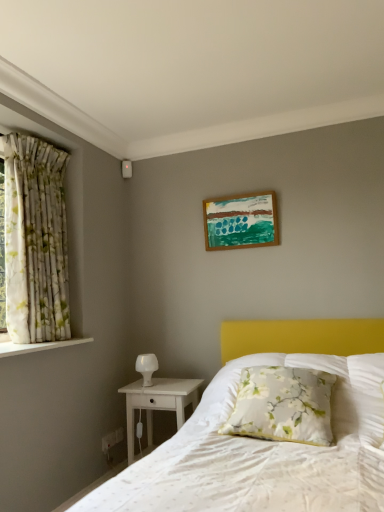
What is the approximate width of floral fabric pillow at center?

It is 49.17 centimeters.

This screenshot has width=384, height=512. What do you see at coordinates (35, 241) in the screenshot?
I see `floral fabric curtain at left` at bounding box center [35, 241].

What do you see at coordinates (241, 221) in the screenshot? The height and width of the screenshot is (512, 384). I see `wooden picture frame at upper center` at bounding box center [241, 221].

Locate an element on the screen. This screenshot has height=512, width=384. white wood nightstand at lower left is located at coordinates (158, 403).

Can you confirm if white wood nightstand at lower left is thinner than wooden picture frame at upper center?

In fact, white wood nightstand at lower left might be wider than wooden picture frame at upper center.

Consider the image. Which is nearer, (172, 404) or (250, 238)?

Point (172, 404) is positioned closer to the camera compared to point (250, 238).

Based on their positions, is white wood nightstand at lower left located to the left or right of wooden picture frame at upper center?

white wood nightstand at lower left is to the left of wooden picture frame at upper center.

Is wooden picture frame at upper center positioned beyond the bounds of floral fabric curtain at left?

Yes, wooden picture frame at upper center is located beyond the bounds of floral fabric curtain at left.

In terms of size, does wooden picture frame at upper center appear bigger or smaller than floral fabric curtain at left?

wooden picture frame at upper center is smaller than floral fabric curtain at left.

Is point (264, 210) farther from viewer compared to point (19, 319)?

Yes, it is.

From the image's perspective, which one is positioned higher, wooden picture frame at upper center or floral fabric curtain at left?

wooden picture frame at upper center, from the image's perspective.

From a real-world perspective, between wooden picture frame at upper center and white wood nightstand at lower left, who is vertically higher?

In real-world perspective, wooden picture frame at upper center is above.

Considering the relative sizes of wooden picture frame at upper center and white wood nightstand at lower left in the image provided, is wooden picture frame at upper center wider than white wood nightstand at lower left?

No, wooden picture frame at upper center is not wider than white wood nightstand at lower left.

At what (x,y) coordinates should I click in order to perform the action: click on nightstand in front of the wooden picture frame at upper center. Please return your answer as a coordinate pair (x, y). The height and width of the screenshot is (512, 384). Looking at the image, I should click on (158, 403).

How many degrees apart are the facing directions of wooden picture frame at upper center and white wood nightstand at lower left?

0.88 degrees.

Are floral fabric curtain at left and wooden picture frame at upper center beside each other?

A: No.

Measure the distance from floral fabric curtain at left to wooden picture frame at upper center.

floral fabric curtain at left is 3.81 feet from wooden picture frame at upper center.

Between floral fabric curtain at left and wooden picture frame at upper center, which one appears on the right side from the viewer's perspective?

From the viewer's perspective, wooden picture frame at upper center appears more on the right side.

Is wooden picture frame at upper center located within floral fabric curtain at left?

No, wooden picture frame at upper center is not inside floral fabric curtain at left.

Is white wood nightstand at lower left bigger or smaller than floral fabric curtain at left?

Clearly, white wood nightstand at lower left is smaller in size than floral fabric curtain at left.

Considering the relative sizes of white wood nightstand at lower left and floral fabric curtain at left in the image provided, is white wood nightstand at lower left thinner than floral fabric curtain at left?

In fact, white wood nightstand at lower left might be wider than floral fabric curtain at left.

Can floral fabric curtain at left be found inside white wood nightstand at lower left?

No, white wood nightstand at lower left does not contain floral fabric curtain at left.

What's the angular difference between white wood nightstand at lower left and floral fabric curtain at left's facing directions?

The angle between the facing direction of white wood nightstand at lower left and the facing direction of floral fabric curtain at left is 87.9 degrees.

Visually, is wooden picture frame at upper center positioned to the left or to the right of white frosted glass table lamp at lower left?

wooden picture frame at upper center is to the right of white frosted glass table lamp at lower left.

Can you confirm if wooden picture frame at upper center is wider than white frosted glass table lamp at lower left?

In fact, wooden picture frame at upper center might be narrower than white frosted glass table lamp at lower left.

From a real-world perspective, is wooden picture frame at upper center beneath white frosted glass table lamp at lower left?

No, from a real-world perspective, wooden picture frame at upper center is not below white frosted glass table lamp at lower left.

Would you say wooden picture frame at upper center contains white frosted glass table lamp at lower left?

No.

Is floral fabric pillow at center touching white frosted glass table lamp at lower left?

No, floral fabric pillow at center is not making contact with white frosted glass table lamp at lower left.

Does floral fabric pillow at center appear on the left side of white frosted glass table lamp at lower left?

No, floral fabric pillow at center is not to the left of white frosted glass table lamp at lower left.

Can you confirm if floral fabric pillow at center is shorter than white frosted glass table lamp at lower left?

In fact, floral fabric pillow at center may be taller than white frosted glass table lamp at lower left.

Is point (255, 426) closer to viewer compared to point (147, 370)?

Yes, point (255, 426) is in front of point (147, 370).

Find the location of a particular element. The height and width of the screenshot is (512, 384). picture frame above the white wood nightstand at lower left (from a real-world perspective) is located at coordinates (241, 221).

The height and width of the screenshot is (512, 384). What are the coordinates of `curtain lying below the wooden picture frame at upper center (from the image's perspective)` in the screenshot? It's located at (35, 241).

Considering their positions, is floral fabric curtain at left positioned closer to white wood nightstand at lower left than wooden picture frame at upper center?

The object closer to white wood nightstand at lower left is floral fabric curtain at left.

Based on their spatial positions, is white frosted glass table lamp at lower left or floral fabric pillow at center closer to floral fabric curtain at left?

white frosted glass table lamp at lower left.

Which object lies further to the anchor point white frosted glass table lamp at lower left, floral fabric pillow at center or floral fabric curtain at left?

floral fabric pillow at center lies further to white frosted glass table lamp at lower left than the other object.

When comparing their distances from wooden picture frame at upper center, does floral fabric pillow at center or white frosted glass table lamp at lower left seem closer?

Based on the image, white frosted glass table lamp at lower left appears to be nearer to wooden picture frame at upper center.

When comparing their distances from floral fabric curtain at left, does white wood nightstand at lower left or floral fabric pillow at center seem closer?

white wood nightstand at lower left lies closer to floral fabric curtain at left than the other object.

Based on the photo, estimate the real-world distances between objects in this image. Which object is further from white frosted glass table lamp at lower left, wooden picture frame at upper center or white wood nightstand at lower left?

wooden picture frame at upper center is further to white frosted glass table lamp at lower left.

Estimate the real-world distances between objects in this image. Which object is closer to white wood nightstand at lower left, floral fabric pillow at center or wooden picture frame at upper center?

Based on the image, floral fabric pillow at center appears to be nearer to white wood nightstand at lower left.

Based on their spatial positions, is white wood nightstand at lower left or floral fabric pillow at center closer to wooden picture frame at upper center?

white wood nightstand at lower left.

In order to click on picture frame located between floral fabric curtain at left and floral fabric pillow at center in the left-right direction in this screenshot , I will do `click(241, 221)`.

Identify the location of curtain between wooden picture frame at upper center and white wood nightstand at lower left in the up-down direction. [35, 241].

Find the location of a particular element. nightstand between floral fabric pillow at center and white frosted glass table lamp at lower left along the z-axis is located at coordinates (158, 403).

Find the location of a particular element. table lamp between floral fabric curtain at left and wooden picture frame at upper center in the horizontal direction is located at coordinates (146, 367).